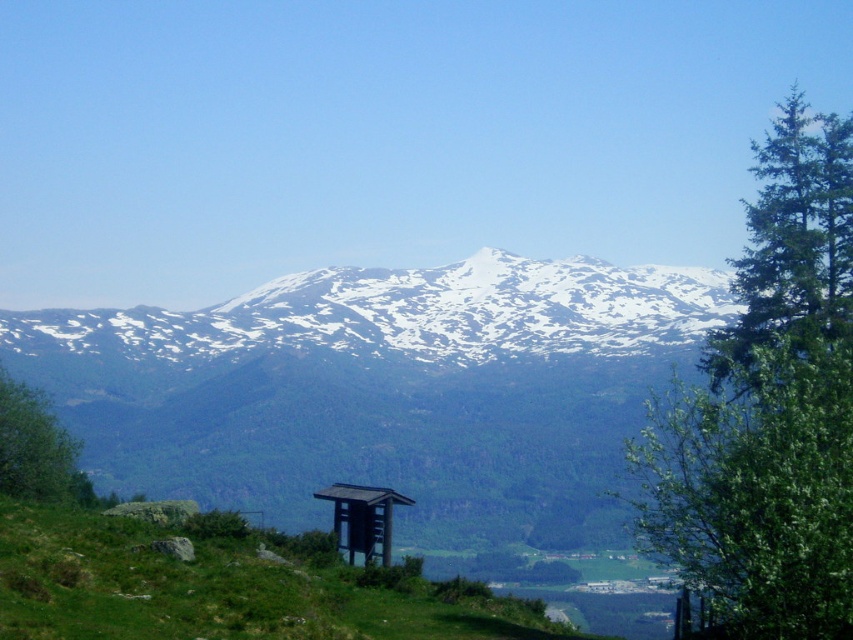
Based on the photo, measure the distance between point [714,593] and camera.

Point [714,593] and camera are 231.58 feet apart from each other.

Does point (786, 568) come in front of point (339, 524)?

Yes.

Does point (729, 560) come closer to viewer compared to point (376, 509)?

Yes, point (729, 560) is in front of point (376, 509).

Find the location of a particular element. This screenshot has width=853, height=640. green leafy tree at right is located at coordinates (769, 408).

Is green leafy tree at lower left positioned at the back of brown wooden gazebo at center?

That is True.

Find the location of a particular element. The image size is (853, 640). green leafy tree at lower left is located at coordinates (38, 449).

Is point (28, 435) in front of point (352, 540)?

No, (28, 435) is behind (352, 540).

The width and height of the screenshot is (853, 640). Identify the location of green leafy tree at lower left. (38, 449).

Who is more distant from viewer, [730,561] or [372,300]?

Point [372,300]

Who is shorter, green leafy tree at right or white snow-covered mountain range at center?

white snow-covered mountain range at center

At what (x,y) coordinates should I click in order to perform the action: click on green leafy tree at right. Please return your answer as a coordinate pair (x, y). Looking at the image, I should click on (769, 408).

In order to click on green leafy tree at right in this screenshot , I will do `click(769, 408)`.